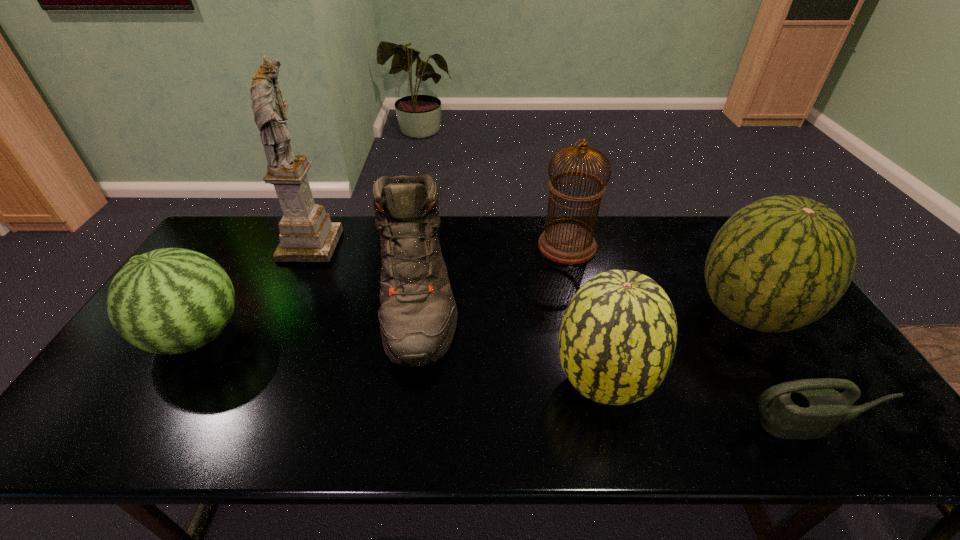
Where is `free space located 0.090m on the front-facing side of the birdcage`? free space located 0.090m on the front-facing side of the birdcage is located at coordinates (512, 246).

Image resolution: width=960 pixels, height=540 pixels. I want to click on vacant space situated 0.390m on the left of the fifth object from right to left, so (x=243, y=295).

Identify the location of free space located on the back of the rightmost watermelon. (702, 238).

Find the location of a particular element. free space located on the left of the second watermelon from right to left is located at coordinates (426, 383).

In order to click on free space located 0.100m on the right of the leftmost watermelon in this screenshot , I will do `click(283, 336)`.

Locate an element on the screen. Image resolution: width=960 pixels, height=540 pixels. sculpture that is at the far edge is located at coordinates (306, 233).

Image resolution: width=960 pixels, height=540 pixels. I want to click on birdcage that is at the far edge, so click(570, 244).

Image resolution: width=960 pixels, height=540 pixels. Find the location of `ski boot at the far edge`. ski boot at the far edge is located at coordinates (418, 315).

At what (x,y) coordinates should I click in order to perform the action: click on watermelon positioned at the near edge. Please return your answer as a coordinate pair (x, y). Looking at the image, I should click on (617, 340).

At what (x,y) coordinates should I click in order to perform the action: click on watering can positioned at the near edge. Please return your answer as a coordinate pair (x, y). Image resolution: width=960 pixels, height=540 pixels. Looking at the image, I should click on click(x=809, y=408).